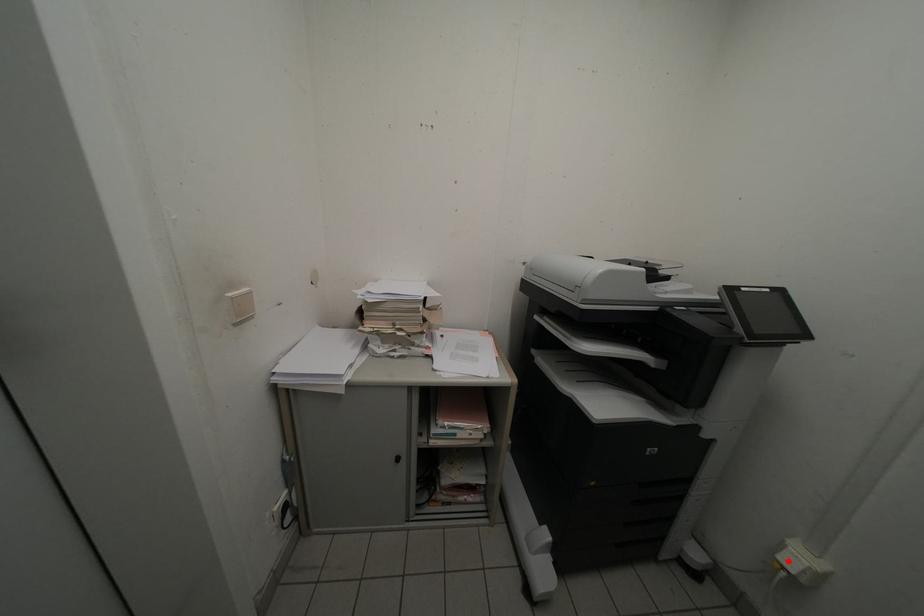
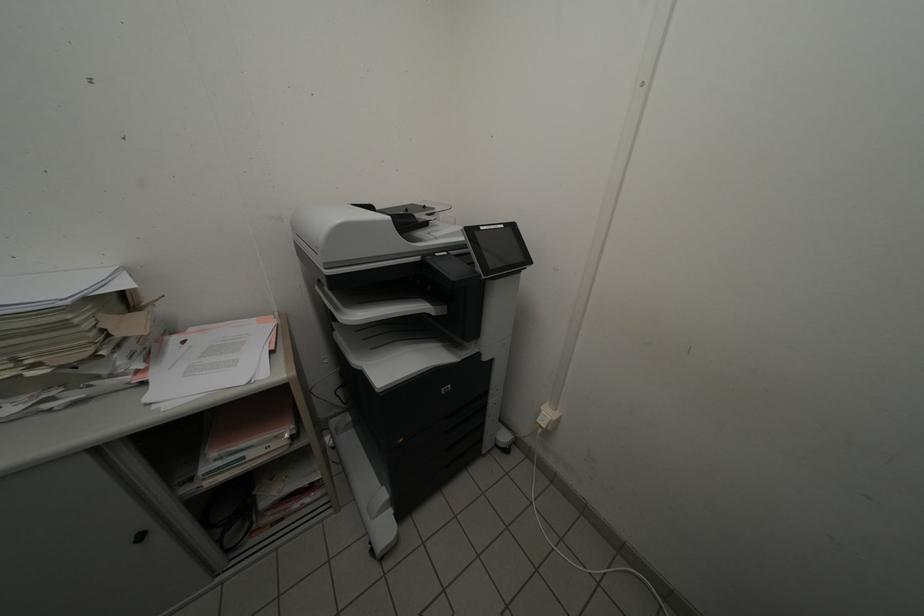
In the second image, find the point that corresponds to the highlighted location in the first image.

(546, 424)